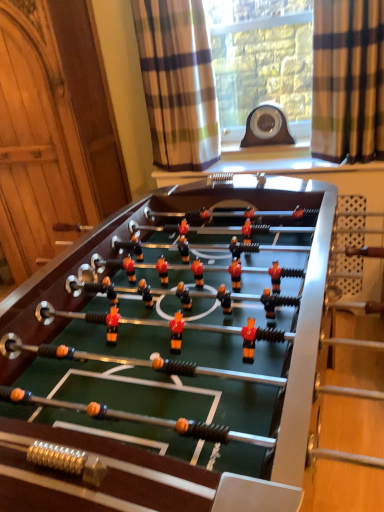
Question: From the image's perspective, is plaid fabric curtain at upper center, the first curtain viewed from the left, positioned above or below green felt table at center?

Choices:
 (A) above
 (B) below

Answer: (A)

Question: Is point (173, 20) positioned closer to the camera than point (236, 464)?

Choices:
 (A) farther
 (B) closer

Answer: (A)

Question: Which object is the farthest from the brown plaid curtain at upper right, which is the first curtain in right-to-left order?

Choices:
 (A) plaid fabric curtain at upper center, the first curtain viewed from the left
 (B) green felt table at center

Answer: (B)

Question: Estimate the real-world distances between objects in this image. Which object is closer to the brown plaid curtain at upper right, placed as the 2th curtain when sorted from left to right?

Choices:
 (A) plaid fabric curtain at upper center, the first curtain viewed from the left
 (B) green felt table at center

Answer: (A)